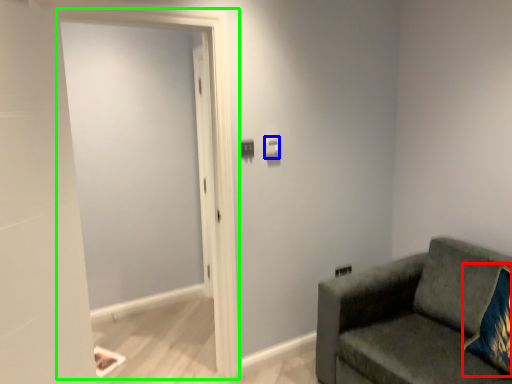
Question: Considering the real-world distances, which object is closest to throw pillow (highlighted by a red box)? light switch (highlighted by a blue box) or screen door (highlighted by a green box).

Choices:
 (A) light switch
 (B) screen door

Answer: (A)